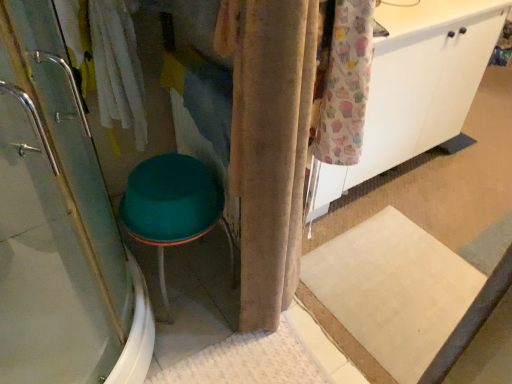
Question: From the image's perspective, does velvet beige curtain at center appear higher than clear glass shower door at left?

Choices:
 (A) no
 (B) yes

Answer: (B)

Question: Considering the relative sizes of velvet beige curtain at center and clear glass shower door at left in the image provided, is velvet beige curtain at center thinner than clear glass shower door at left?

Choices:
 (A) no
 (B) yes

Answer: (B)

Question: Is velvet beige curtain at center shorter than clear glass shower door at left?

Choices:
 (A) no
 (B) yes

Answer: (B)

Question: Is velvet beige curtain at center smaller than clear glass shower door at left?

Choices:
 (A) no
 (B) yes

Answer: (B)

Question: Would you say clear glass shower door at left is part of velvet beige curtain at center's contents?

Choices:
 (A) no
 (B) yes

Answer: (A)

Question: Would you say velvet beige curtain at center is outside clear glass shower door at left?

Choices:
 (A) no
 (B) yes

Answer: (B)

Question: Does clear glass shower door at left have a lesser height compared to velvet beige curtain at center?

Choices:
 (A) no
 (B) yes

Answer: (A)

Question: Does clear glass shower door at left appear on the right side of velvet beige curtain at center?

Choices:
 (A) yes
 (B) no

Answer: (B)

Question: Can you confirm if clear glass shower door at left is wider than velvet beige curtain at center?

Choices:
 (A) yes
 (B) no

Answer: (A)

Question: From the image's perspective, does clear glass shower door at left appear lower than velvet beige curtain at center?

Choices:
 (A) no
 (B) yes

Answer: (B)

Question: Would you say velvet beige curtain at center is part of clear glass shower door at left's contents?

Choices:
 (A) no
 (B) yes

Answer: (A)

Question: Is clear glass shower door at left further to camera compared to velvet beige curtain at center?

Choices:
 (A) no
 (B) yes

Answer: (A)

Question: Does white matte cabinet at upper right turn towards teal plastic stool at lower left?

Choices:
 (A) no
 (B) yes

Answer: (A)